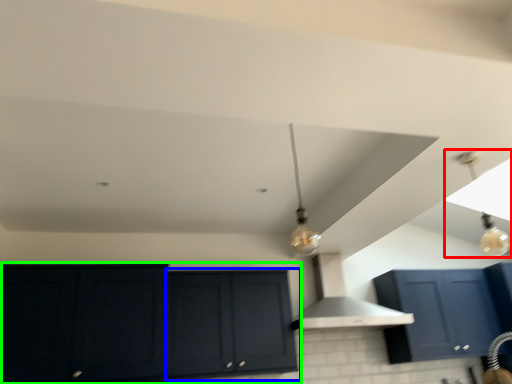
Question: Based on their relative distances, which object is farther from light fixture (highlighted by a red box)? Choose from cabinetry (highlighted by a blue box) and cabinetry (highlighted by a green box).

Choices:
 (A) cabinetry
 (B) cabinetry

Answer: (B)